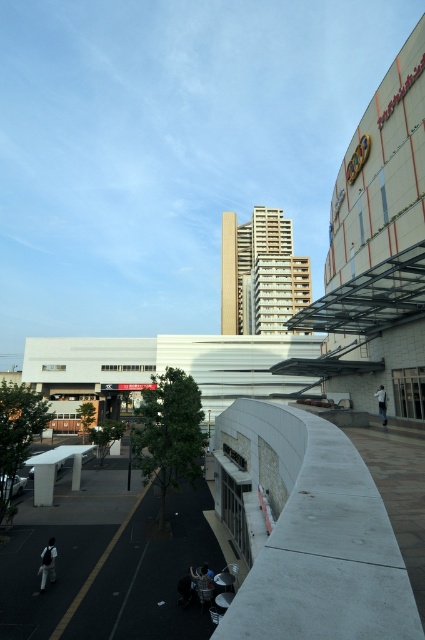
You are standing at the curved concrete barrier and want to take a photo of both point (40,572) and point (377,403) in the scene. Which point should you focus on first to ensure both are in clear view?

You should focus on point (40,572) first because it is closer to the camera than point (377,403). This ensures that both points will be in focus as the camera can capture the depth between them.

You are a delivery person needing to retrieve your metallic silver water bottle at lower center. The dark gray fabric jacket at lower left is blocking your path. Can you reach your water bottle without moving the jacket?

The metallic silver water bottle at lower center is behind the dark gray fabric jacket at lower left, so you can reach it without moving the jacket since it is positioned behind.